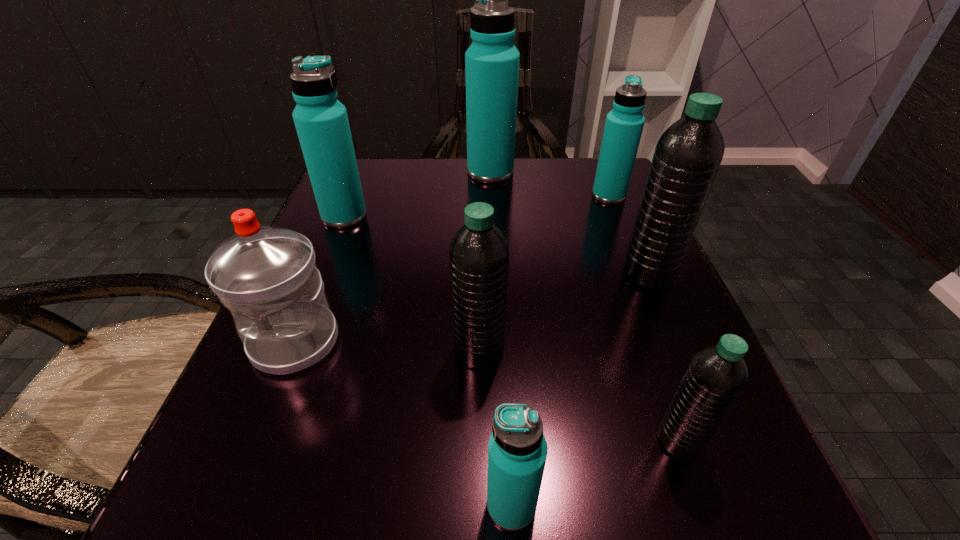
Locate an element on the screen. This screenshot has height=540, width=960. free location located 0.050m on the back of the nearest blue water bottle is located at coordinates (508, 438).

At what (x,y) coordinates should I click in order to perform the action: click on object that is at the far left corner. Please return your answer as a coordinate pair (x, y). Looking at the image, I should click on (321, 121).

You are a GUI agent. You are given a task and a screenshot of the screen. Output one action in this format:
    pyautogui.click(x=<x>, y=<y>)
    Task: Click on the object present at the far right corner
    This screenshot has width=960, height=540.
    Given the screenshot: What is the action you would take?
    point(624,124)

Locate an element on the screen. object located in the near right corner section of the desktop is located at coordinates [716, 376].

Find the location of a particular element. This screenshot has width=960, height=540. free space at the far edge of the desktop is located at coordinates (548, 160).

The width and height of the screenshot is (960, 540). In the image, there is a desktop. Identify the location of vacant space at the left edge. (369, 288).

In the image, there is a desktop. Identify the location of vacant space at the right edge. The image size is (960, 540). (589, 300).

In the image, there is a desktop. Identify the location of blank space at the far left corner. (396, 199).

Where is `free space at the near left corner of the desktop`? This screenshot has height=540, width=960. free space at the near left corner of the desktop is located at coordinates (271, 469).

Locate an element on the screen. This screenshot has width=960, height=540. vacant space at the far right corner of the desktop is located at coordinates (579, 208).